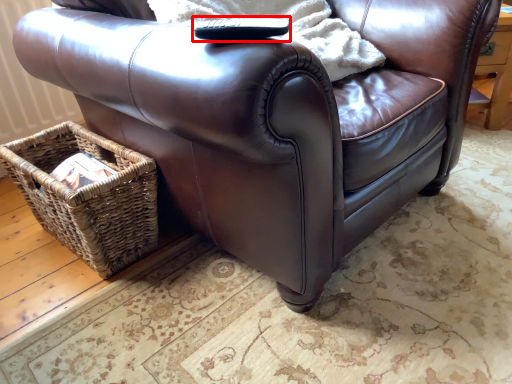
Question: In this image, where is remote (annotated by the red box) located relative to picnic basket?

Choices:
 (A) right
 (B) left

Answer: (A)